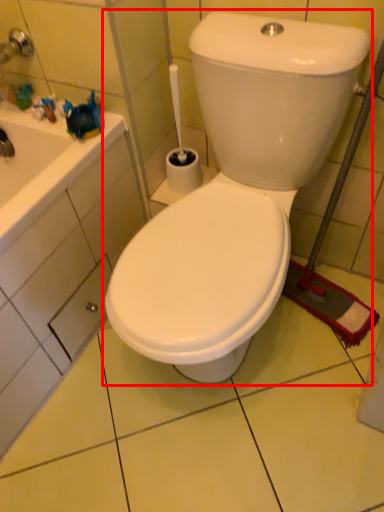
Question: Where is toilet (annotated by the red box) located in relation to drawer in the image?

Choices:
 (A) left
 (B) right

Answer: (B)